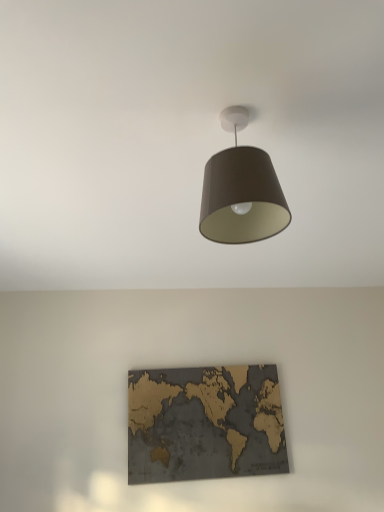
Question: Considering the relative positions of gold textured map at center and matte brown lampshade at upper center in the image provided, is gold textured map at center to the left of matte brown lampshade at upper center from the viewer's perspective?

Choices:
 (A) no
 (B) yes

Answer: (B)

Question: Is gold textured map at center oriented away from matte brown lampshade at upper center?

Choices:
 (A) no
 (B) yes

Answer: (A)

Question: Is gold textured map at center to the right of matte brown lampshade at upper center from the viewer's perspective?

Choices:
 (A) yes
 (B) no

Answer: (B)

Question: Is gold textured map at center aimed at matte brown lampshade at upper center?

Choices:
 (A) no
 (B) yes

Answer: (B)

Question: Considering the relative sizes of gold textured map at center and matte brown lampshade at upper center in the image provided, is gold textured map at center wider than matte brown lampshade at upper center?

Choices:
 (A) yes
 (B) no

Answer: (B)

Question: Is gold textured map at center thinner than matte brown lampshade at upper center?

Choices:
 (A) no
 (B) yes

Answer: (B)

Question: From the image's perspective, is matte brown lampshade at upper center located beneath gold textured map at center?

Choices:
 (A) no
 (B) yes

Answer: (A)

Question: Is matte brown lampshade at upper center turned away from gold textured map at center?

Choices:
 (A) yes
 (B) no

Answer: (B)

Question: Is matte brown lampshade at upper center next to gold textured map at center?

Choices:
 (A) no
 (B) yes

Answer: (A)

Question: Is matte brown lampshade at upper center taller than gold textured map at center?

Choices:
 (A) no
 (B) yes

Answer: (A)

Question: Is matte brown lampshade at upper center completely or partially outside of gold textured map at center?

Choices:
 (A) yes
 (B) no

Answer: (A)

Question: From a real-world perspective, is matte brown lampshade at upper center located beneath gold textured map at center?

Choices:
 (A) yes
 (B) no

Answer: (B)

Question: From the image's perspective, is gold textured map at center positioned above or below matte brown lampshade at upper center?

Choices:
 (A) below
 (B) above

Answer: (A)